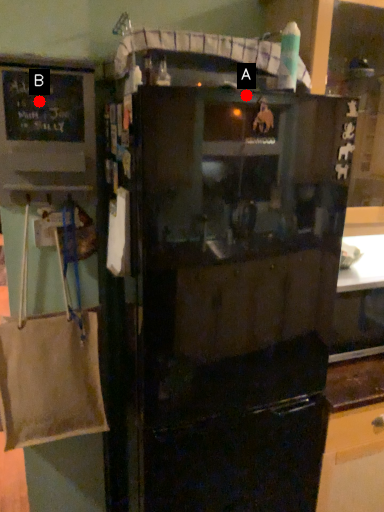
Question: Two points are circled on the image, labeled by A and B beside each circle. Which of the following is the farthest from the observer?

Choices:
 (A) A is further
 (B) B is further

Answer: (B)